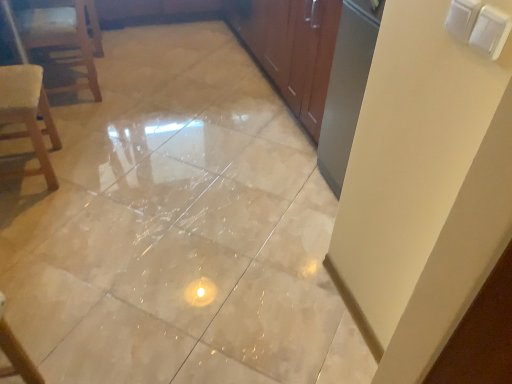
The height and width of the screenshot is (384, 512). I want to click on wooden chair at left, so click(x=65, y=38).

Which is further, [79,29] or [34,78]?

The point [79,29] is behind.

From a real-world perspective, which is physically above, wooden chair at left or wooden textured chair at left?

In real-world perspective, wooden textured chair at left is above.

Considering the sizes of wooden chair at left and wooden textured chair at left in the image, is wooden chair at left taller or shorter than wooden textured chair at left?

Considering their sizes, wooden chair at left has less height than wooden textured chair at left.

How different are the orientations of wooden chair at left and wooden textured chair at left in degrees?

wooden chair at left and wooden textured chair at left are facing 174 degrees away from each other.

Is wooden textured chair at left to the left of wooden chair at left from the viewer's perspective?

Incorrect, wooden textured chair at left is not on the left side of wooden chair at left.

From a real-world perspective, is wooden textured chair at left positioned under wooden chair at left based on gravity?

Actually, wooden textured chair at left is physically above wooden chair at left in the real world.

What's the angular difference between wooden textured chair at left and wooden chair at left's facing directions?

The angular difference between wooden textured chair at left and wooden chair at left is 174 degrees.

Where is `furniture lying above the wooden textured chair at left (from the image's perspective)`? The width and height of the screenshot is (512, 384). furniture lying above the wooden textured chair at left (from the image's perspective) is located at coordinates (65, 38).

Considering the relative positions of wooden textured chair at left and beige glossy tile at center in the image provided, is wooden textured chair at left to the left of beige glossy tile at center from the viewer's perspective?

Yes, wooden textured chair at left is to the left of beige glossy tile at center.

From the image's perspective, would you say wooden textured chair at left is shown under beige glossy tile at center?

Yes.

Which is behind, wooden textured chair at left or beige glossy tile at center?

wooden textured chair at left is further from the camera.

Measure the distance between wooden textured chair at left and beige glossy tile at center.

The distance of wooden textured chair at left from beige glossy tile at center is 22.41 inches.

How much distance is there between beige glossy tile at center and wooden chair at left?

beige glossy tile at center and wooden chair at left are 33.03 inches apart from each other.

Looking at this image, is beige glossy tile at center positioned behind wooden chair at left?

No.

The image size is (512, 384). What are the coordinates of `furniture on the left of beige glossy tile at center` in the screenshot? It's located at (65, 38).

From a real-world perspective, is beige glossy tile at center over wooden chair at left?

No, from a real-world perspective, beige glossy tile at center is not above wooden chair at left.

Is beige glossy tile at center oriented away from wooden textured chair at left?

That's not correct — beige glossy tile at center is not looking away from wooden textured chair at left.

From the image's perspective, would you say beige glossy tile at center is positioned over wooden textured chair at left?

Yes, from the image's perspective, beige glossy tile at center is above wooden textured chair at left.

Is beige glossy tile at center taller or shorter than wooden textured chair at left?

In the image, beige glossy tile at center appears to be shorter than wooden textured chair at left.

Considering the points (134, 173) and (26, 118), which point is behind, point (134, 173) or point (26, 118)?

Positioned behind is point (26, 118).

Is beige glossy tile at center at the back of wooden chair at left?

No.

Considering the positions of objects wooden chair at left and beige glossy tile at center in the image provided, who is more to the right, wooden chair at left or beige glossy tile at center?

Positioned to the right is beige glossy tile at center.

Between wooden chair at left and beige glossy tile at center, which one has smaller width?

wooden chair at left is thinner.

Is there a large distance between wooden chair at left and beige glossy tile at center?

No.

This screenshot has width=512, height=384. What are the coordinates of `chair on the right of wooden chair at left` in the screenshot? It's located at (28, 115).

The image size is (512, 384). I want to click on furniture located above the wooden textured chair at left (from the image's perspective), so click(x=65, y=38).

Considering their positions, is beige glossy tile at center positioned further to wooden chair at left than wooden textured chair at left?

The object further to wooden chair at left is beige glossy tile at center.

Looking at the image, which one is located further to wooden textured chair at left, beige glossy tile at center or wooden chair at left?

beige glossy tile at center.

From the image, which object appears to be nearer to beige glossy tile at center, wooden textured chair at left or wooden chair at left?

wooden textured chair at left is closer to beige glossy tile at center.

Estimate the real-world distances between objects in this image. Which object is further from wooden textured chair at left, wooden chair at left or beige glossy tile at center?

beige glossy tile at center is further to wooden textured chair at left.

Considering their positions, is wooden chair at left positioned further to beige glossy tile at center than wooden textured chair at left?

wooden chair at left lies further to beige glossy tile at center than the other object.

Which object lies nearer to the anchor point wooden chair at left, wooden textured chair at left or beige glossy tile at center?

Among the two, wooden textured chair at left is located nearer to wooden chair at left.

Image resolution: width=512 pixels, height=384 pixels. I want to click on chair between beige glossy tile at center and wooden chair at left from front to back, so click(x=28, y=115).